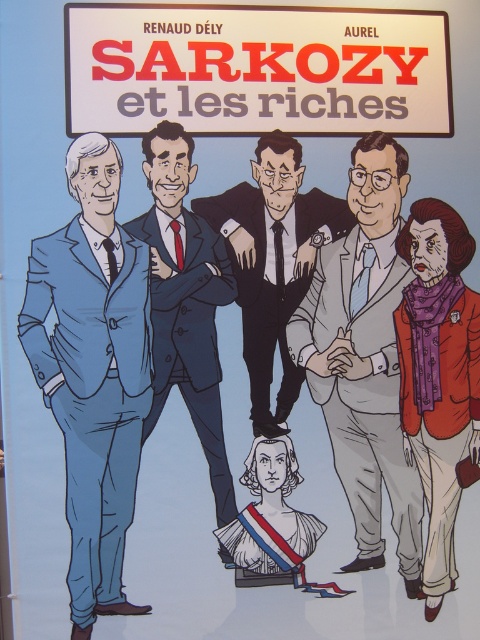
Question: Which object appears closest to the camera in this image?

Choices:
 (A) blue suit at center
 (B) blue fabric suit at left
 (C) white paper sign at upper center

Answer: (B)

Question: Does blue fabric suit at left appear on the right side of smooth black suit at center?

Choices:
 (A) no
 (B) yes

Answer: (A)

Question: Can you confirm if purple fabric scarf at lower right is bigger than blue suit at center?

Choices:
 (A) yes
 (B) no

Answer: (B)

Question: Does white paper sign at upper center come in front of light gray suit at center?

Choices:
 (A) no
 (B) yes

Answer: (B)

Question: Estimate the real-world distances between objects in this image. Which object is farther from the blue fabric suit at left?

Choices:
 (A) light gray suit at center
 (B) purple fabric scarf at lower right
 (C) white paper sign at upper center

Answer: (B)

Question: Which point is closer to the camera?

Choices:
 (A) matte white bust at center
 (B) purple fabric scarf at lower right
 (C) smooth black suit at center

Answer: (A)